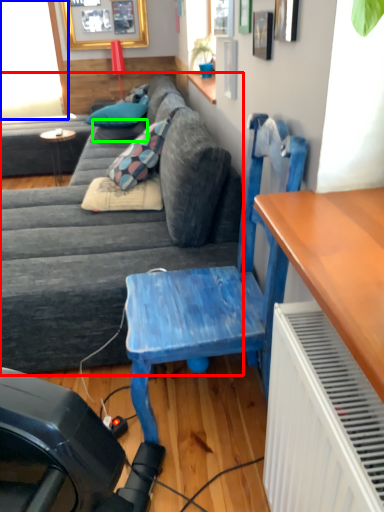
Question: Which object is the closest to the studio couch (highlighted by a red box)? Choose among these: window screen (highlighted by a blue box) or pillow (highlighted by a green box).

Choices:
 (A) window screen
 (B) pillow

Answer: (B)